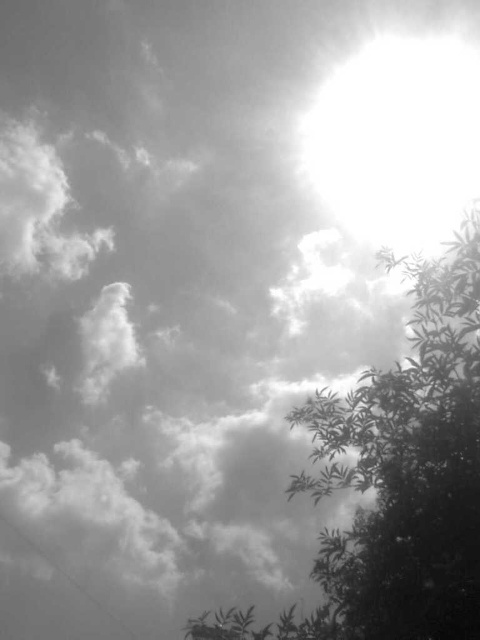
You are standing in the scene and want to touch the silhouetted leafy branch at lower right. Based on its position, which direction should you move to reach it?

The silhouetted leafy branch at lower right is located at point 0.747 on the x and 0.829 on the y, so you should move towards the lower right direction to reach it.

You are an astronomer analyzing this image. You notice the silhouetted leafy branch at lower right and the bright white sun at upper right. Which object is positioned to the left of the other?

The silhouetted leafy branch at lower right is to the left of the bright white sun at upper right.

You are an astronomer analyzing this image. You notice a point at coordinates (397, 477). Based on the scene description, what object does this point most likely represent?

The point at coordinates (397, 477) corresponds to the silhouetted leafy branch at lower right as described in the scene.